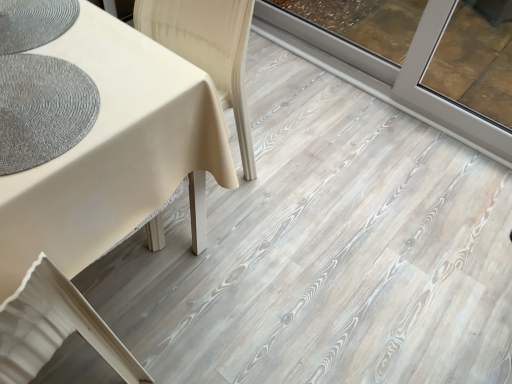
Question: Choose the correct answer: Is textured gray mat at left inside white matte swivel chair at lower left or outside it?

Choices:
 (A) inside
 (B) outside

Answer: (B)

Question: From the image's perspective, relative to white matte swivel chair at lower left, is textured gray mat at left above or below?

Choices:
 (A) below
 (B) above

Answer: (B)

Question: Is textured gray mat at left wider or thinner than white matte swivel chair at lower left?

Choices:
 (A) thin
 (B) wide

Answer: (A)

Question: Relative to textured gray mat at left, is white matte swivel chair at lower left in front or behind?

Choices:
 (A) front
 (B) behind

Answer: (A)

Question: Considering the relative positions of white matte swivel chair at lower left and textured gray mat at left in the image provided, is white matte swivel chair at lower left to the left or to the right of textured gray mat at left?

Choices:
 (A) left
 (B) right

Answer: (A)

Question: Looking at the image, does white matte swivel chair at lower left seem bigger or smaller compared to textured gray mat at left?

Choices:
 (A) big
 (B) small

Answer: (A)

Question: In terms of height, does white matte swivel chair at lower left look taller or shorter compared to textured gray mat at left?

Choices:
 (A) tall
 (B) short

Answer: (A)